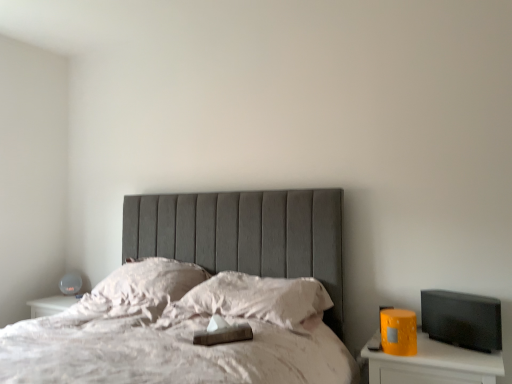
Question: Is matte white table lamp at left far away from white soft pillow at center, the 2th pillow when ordered from left to right?

Choices:
 (A) no
 (B) yes

Answer: (B)

Question: Could white soft pillow at center, the 2th pillow when ordered from left to right, be considered to be inside matte white table lamp at left?

Choices:
 (A) yes
 (B) no

Answer: (B)

Question: From a real-world perspective, is matte white table lamp at left located beneath white soft pillow at center, the 2th pillow when ordered from left to right?

Choices:
 (A) yes
 (B) no

Answer: (A)

Question: From a real-world perspective, is matte white table lamp at left over white soft pillow at center, the 2th pillow when ordered from left to right?

Choices:
 (A) no
 (B) yes

Answer: (A)

Question: Is matte white table lamp at left facing towards white soft pillow at center, which ranks as the first pillow in right-to-left order?

Choices:
 (A) yes
 (B) no

Answer: (B)

Question: From a real-world perspective, relative to white soft pillow at center, which ranks as the first pillow in right-to-left order, is white soft pillow at center, arranged as the 2th pillow when viewed from the right, vertically above or below?

Choices:
 (A) above
 (B) below

Answer: (A)

Question: In the image, is white soft pillow at center, marked as the first pillow in a left-to-right arrangement, positioned in front of or behind white soft pillow at center, the 2th pillow when ordered from left to right?

Choices:
 (A) behind
 (B) front

Answer: (A)

Question: Would you say white soft pillow at center, marked as the first pillow in a left-to-right arrangement, is to the left or to the right of white soft pillow at center, which ranks as the first pillow in right-to-left order, in the picture?

Choices:
 (A) right
 (B) left

Answer: (B)

Question: Considering the positions of white soft pillow at center, marked as the first pillow in a left-to-right arrangement, and white soft pillow at center, which ranks as the first pillow in right-to-left order, in the image, is white soft pillow at center, marked as the first pillow in a left-to-right arrangement, bigger or smaller than white soft pillow at center, which ranks as the first pillow in right-to-left order,?

Choices:
 (A) big
 (B) small

Answer: (A)

Question: Considering the positions of white soft pillow at center, the 2th pillow when ordered from left to right, and matte yellow nightstand at right in the image, is white soft pillow at center, the 2th pillow when ordered from left to right, taller or shorter than matte yellow nightstand at right?

Choices:
 (A) tall
 (B) short

Answer: (B)

Question: Does point (285, 304) appear closer or farther from the camera than point (422, 339)?

Choices:
 (A) farther
 (B) closer

Answer: (B)

Question: From a real-world perspective, relative to matte yellow nightstand at right, is white soft pillow at center, which ranks as the first pillow in right-to-left order, vertically above or below?

Choices:
 (A) above
 (B) below

Answer: (A)

Question: In the image, is white soft pillow at center, the 2th pillow when ordered from left to right, on the left side or the right side of matte yellow nightstand at right?

Choices:
 (A) right
 (B) left

Answer: (B)

Question: Looking at their shapes, would you say white soft pillow at center, arranged as the 2th pillow when viewed from the right, is wider or thinner than matte white table lamp at left?

Choices:
 (A) wide
 (B) thin

Answer: (A)

Question: Visually, is white soft pillow at center, arranged as the 2th pillow when viewed from the right, positioned to the left or to the right of matte white table lamp at left?

Choices:
 (A) right
 (B) left

Answer: (A)